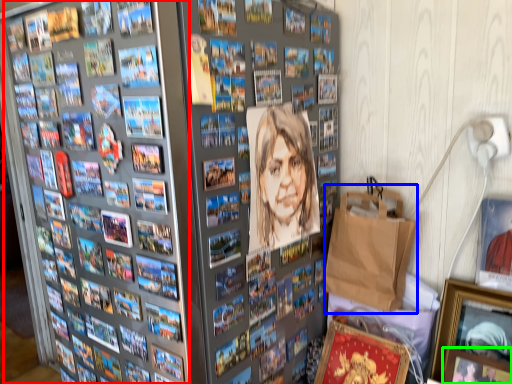
Question: Which is farther away from comic book (highlighted by a red box)? paper bag (highlighted by a blue box) or picture frame (highlighted by a green box)?

Choices:
 (A) paper bag
 (B) picture frame

Answer: (B)